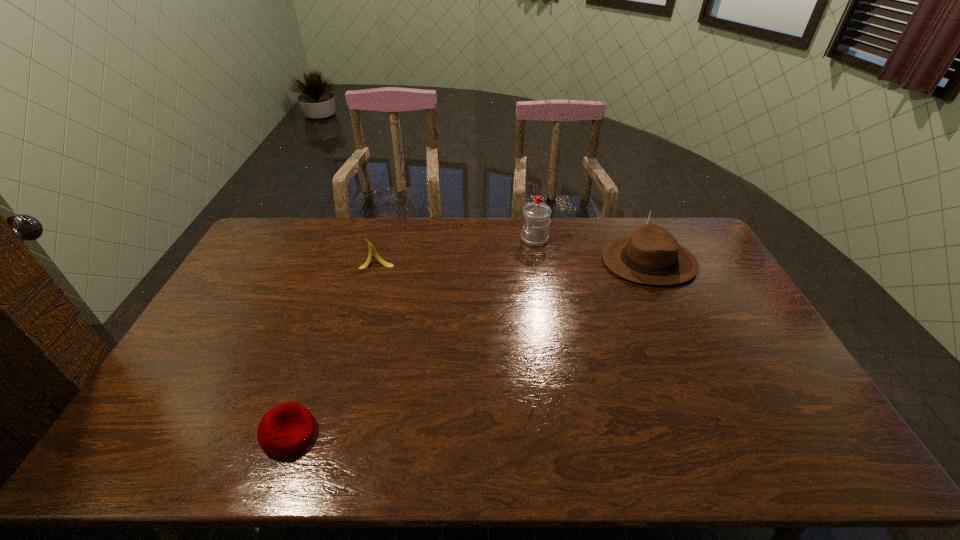
Locate an element on the screen. This screenshot has height=540, width=960. object that is at the far right corner is located at coordinates (651, 255).

You are a GUI agent. You are given a task and a screenshot of the screen. Output one action in this format:
    pyautogui.click(x=<x>, y=<y>)
    Task: Click on the free space at the far edge of the desktop
    The width and height of the screenshot is (960, 540).
    Given the screenshot: What is the action you would take?
    pyautogui.click(x=575, y=250)

The width and height of the screenshot is (960, 540). I want to click on vacant area at the near edge, so click(x=355, y=449).

At what (x,y) coordinates should I click in order to perform the action: click on vacant space at the left edge. Please return your answer as a coordinate pair (x, y). Image resolution: width=960 pixels, height=540 pixels. Looking at the image, I should click on (189, 349).

This screenshot has width=960, height=540. I want to click on vacant space at the right edge of the desktop, so click(x=764, y=430).

You are a GUI agent. You are given a task and a screenshot of the screen. Output one action in this format:
    pyautogui.click(x=<x>, y=<y>)
    Task: Click on the free spot between the banana and the tallest object
    This screenshot has width=960, height=540.
    Given the screenshot: What is the action you would take?
    pyautogui.click(x=456, y=249)

This screenshot has width=960, height=540. In order to click on free space between the banana and the rightmost object in this screenshot , I will do `click(513, 261)`.

The height and width of the screenshot is (540, 960). I want to click on free space between the third tallest object and the tallest object, so click(456, 249).

I want to click on vacant space in between the tallest object and the nearest object, so click(412, 336).

At what (x,y) coordinates should I click in order to perform the action: click on free space between the nearest object and the fedora. Please return your answer as a coordinate pair (x, y). The height and width of the screenshot is (540, 960). Looking at the image, I should click on (468, 348).